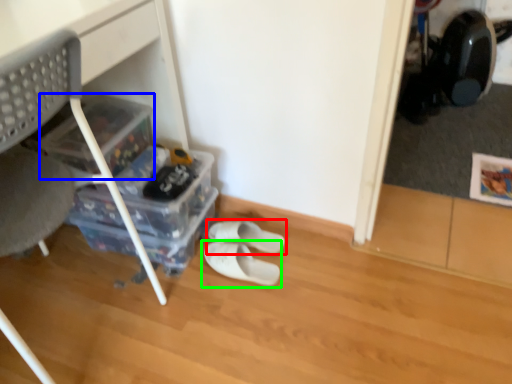
Question: Which is farther away from footwear (highlighted by a red box)? storage box (highlighted by a blue box) or footwear (highlighted by a green box)?

Choices:
 (A) storage box
 (B) footwear

Answer: (A)